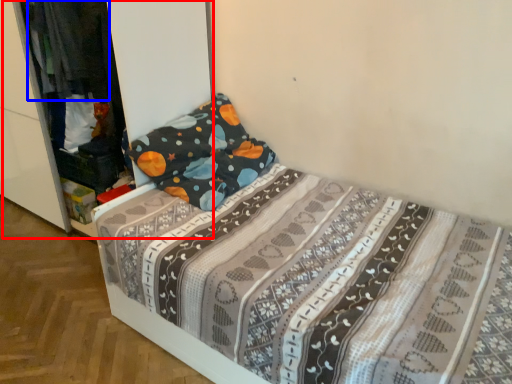
Question: Which point is further to the camera, dresser (highlighted by a red box) or clothing (highlighted by a blue box)?

Choices:
 (A) dresser
 (B) clothing

Answer: (B)